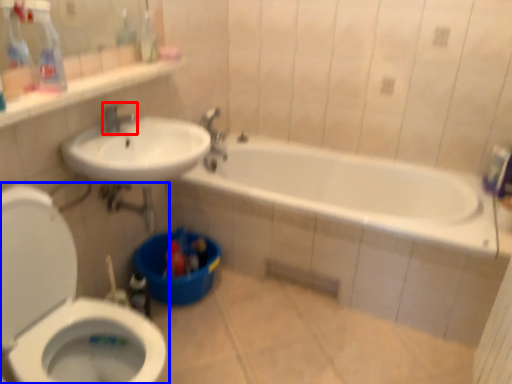
Question: Which point is closer to the camera, tap (highlighted by a red box) or toilet (highlighted by a blue box)?

Choices:
 (A) tap
 (B) toilet

Answer: (B)